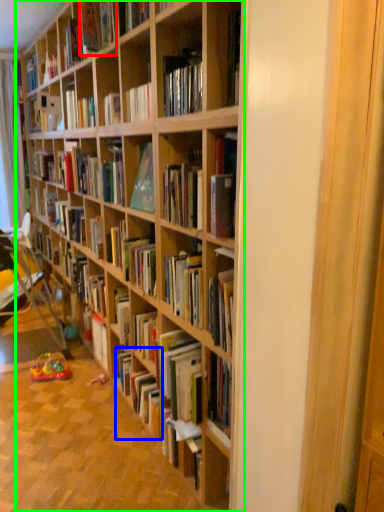
Question: Which object is the farthest from book (highlighted by a red box)? Choose among these: book (highlighted by a blue box) or bookcase (highlighted by a green box).

Choices:
 (A) book
 (B) bookcase

Answer: (A)